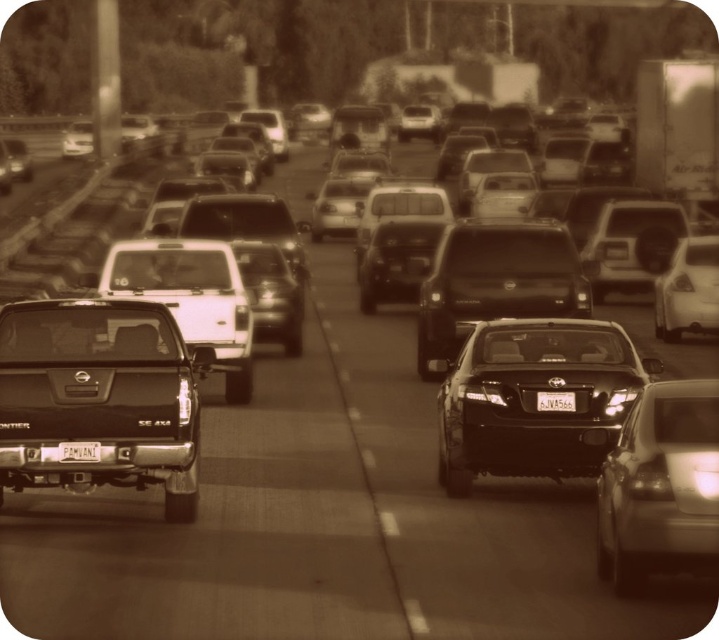
You are a photographer standing on the sidewalk observing the traffic jam. You notice the matte black sedan at center and the metallic silver sedan at right. Which vehicle would appear taller in your photo?

The matte black sedan at center is much taller than the metallic silver sedan at right, so it would appear taller in the photo.

You are a traffic officer trying to locate a specific vehicle. According to the coordinates provided, where exactly is the matte black sedan at center positioned in the image?

The matte black sedan at center is located at coordinates point (495, 280).

From the picture: You are a photographer trying to capture the shiny black sedan at center and the white matte license plate at center in the same frame. Since you want to ensure both are fully visible, which object should you adjust your camera angle to focus on first to account for its larger size?

The shiny black sedan at center is wider than the white matte license plate at center, so you should focus on the shiny black sedan at center first to ensure it fits in the frame before adjusting for the smaller license plate.